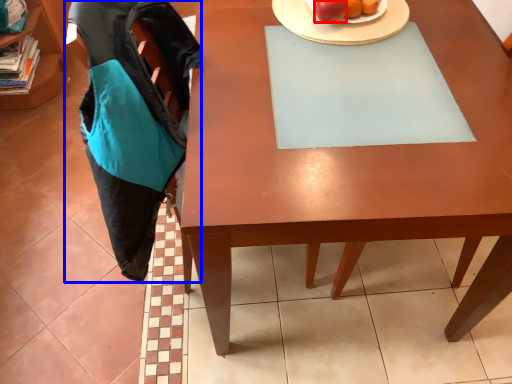
Question: Which object is closer to the camera taking this photo, apple (highlighted by a red box) or swivel chair (highlighted by a blue box)?

Choices:
 (A) apple
 (B) swivel chair

Answer: (B)